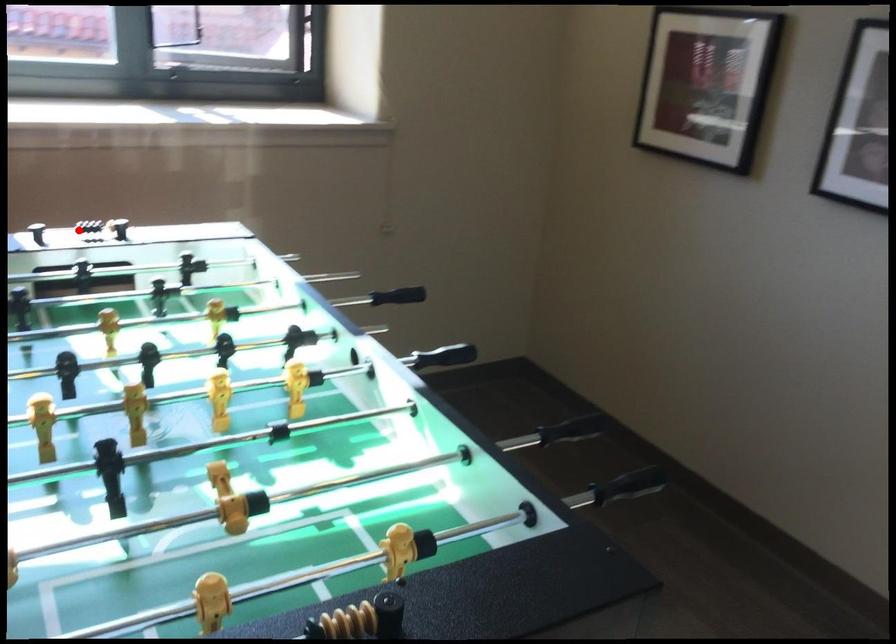
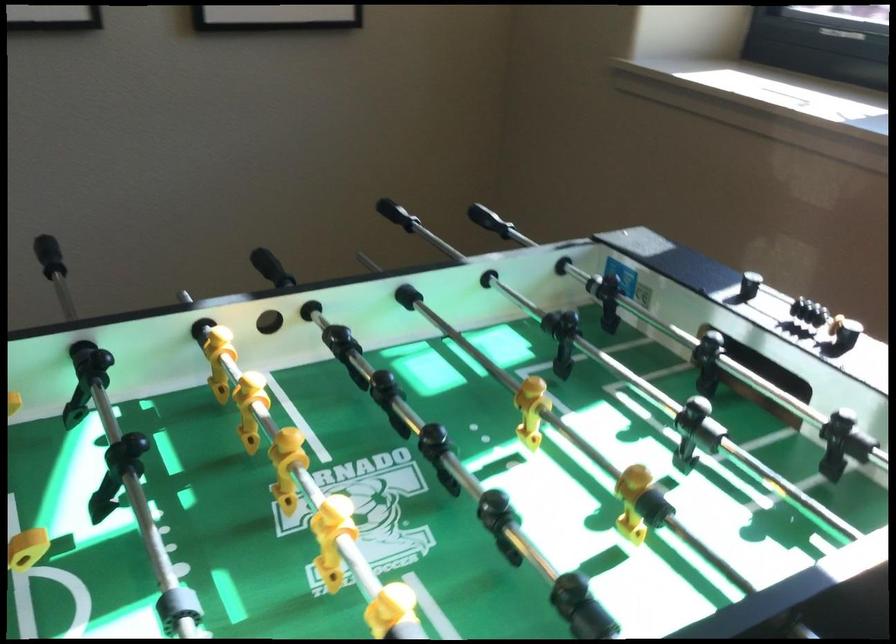
The point at the highlighted location is marked in the first image. Where is the corresponding point in the second image?

(819, 315)